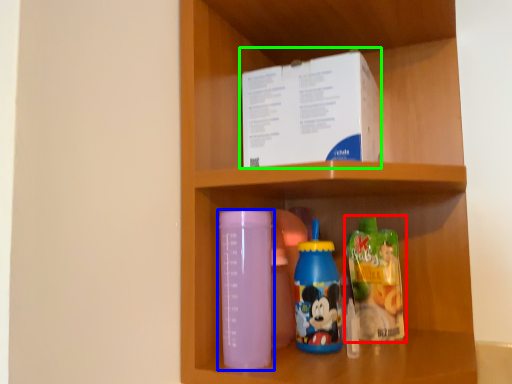
Question: Which object is positioned closest to bottle (highlighted by a red box)? Select from bottle (highlighted by a blue box) and box (highlighted by a green box).

Choices:
 (A) bottle
 (B) box

Answer: (A)